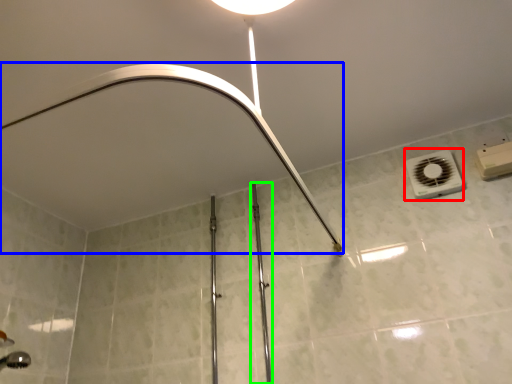
Question: Which is farther away from air conditioning (highlighted by a red box)? shower (highlighted by a blue box) or rail (highlighted by a green box)?

Choices:
 (A) shower
 (B) rail

Answer: (B)